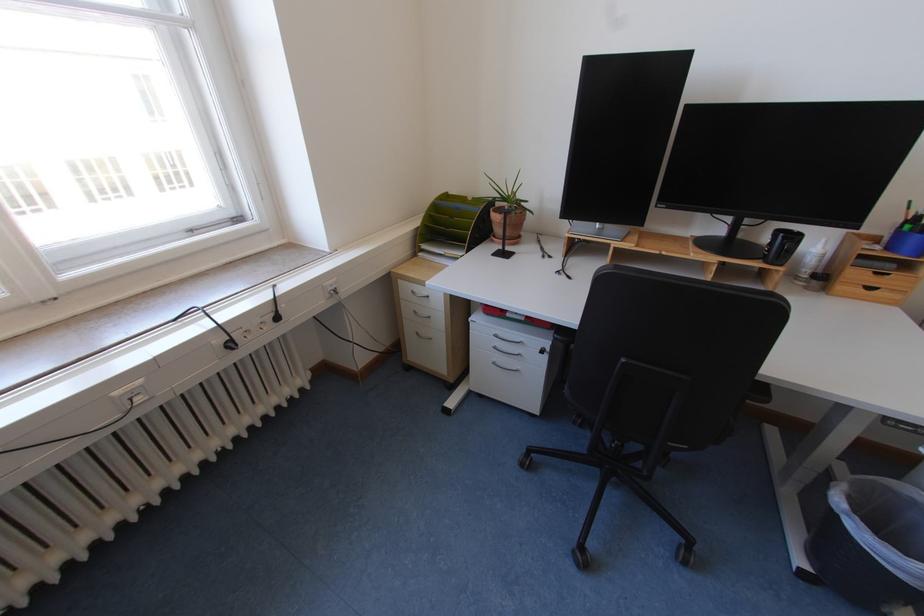
The location [453,225] corresponds to which object?

It corresponds to the green file holder in the image.